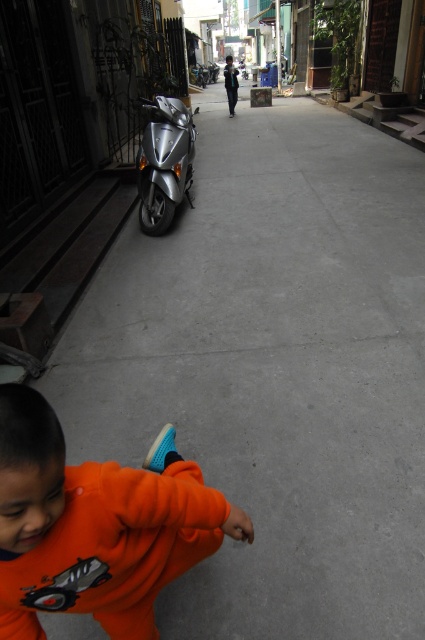
Is orange fleece at lower left to the right of silver metallic motorcycle at center from the viewer's perspective?

Yes, orange fleece at lower left is to the right of silver metallic motorcycle at center.

What do you see at coordinates (96, 525) in the screenshot? I see `orange fleece at lower left` at bounding box center [96, 525].

At what (x,y) coordinates should I click in order to perform the action: click on orange fleece at lower left. Please return your answer as a coordinate pair (x, y). Image resolution: width=425 pixels, height=640 pixels. Looking at the image, I should click on (96, 525).